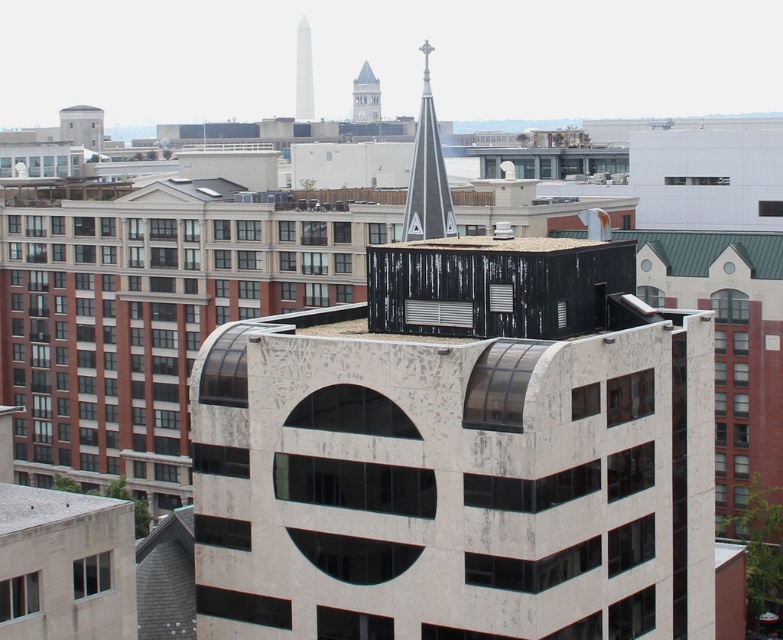
Question: Which point is farther from the camera taking this photo?

Choices:
 (A) (370, 88)
 (B) (760, 256)

Answer: (A)

Question: Considering the real-world distances, which object is closest to the gray shingles spire at upper center?

Choices:
 (A) smooth gray steeple at upper center
 (B) green corrugated metal roof at upper right
 (C) white marble tower at upper center

Answer: (B)

Question: Observing the image, what is the correct spatial positioning of green corrugated metal roof at upper right in reference to gray shingles spire at upper center?

Choices:
 (A) left
 (B) right

Answer: (B)

Question: Based on their relative distances, which object is nearer to the green corrugated metal roof at upper right?

Choices:
 (A) gray shingles spire at upper center
 (B) white marble tower at upper center

Answer: (A)

Question: Is green corrugated metal roof at upper right to the right of white marble tower at upper center from the viewer's perspective?

Choices:
 (A) yes
 (B) no

Answer: (A)

Question: Is gray shingles spire at upper center to the left of smooth gray steeple at upper center from the viewer's perspective?

Choices:
 (A) no
 (B) yes

Answer: (A)